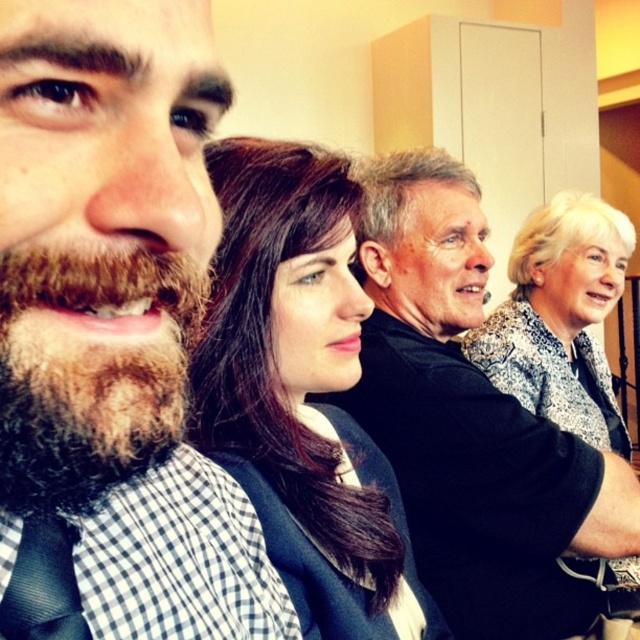
Question: Which object appears farthest from the camera in this image?

Choices:
 (A) brown fuzzy beard at left
 (B) checkered fabric shirt at left

Answer: (A)

Question: Can you confirm if black matte shirt at center is positioned above white printed blouse at upper right?

Choices:
 (A) yes
 (B) no

Answer: (B)

Question: Which of these objects is positioned closest to the white printed blouse at upper right?

Choices:
 (A) checkered fabric shirt at left
 (B) brown fuzzy beard at left
 (C) black matte shirt at center
 (D) dark brown hair at center

Answer: (C)

Question: Is checkered fabric shirt at left to the left of dark brown hair at center from the viewer's perspective?

Choices:
 (A) no
 (B) yes

Answer: (B)

Question: Which of the following is the farthest from the observer?

Choices:
 (A) checkered fabric shirt at left
 (B) black matte shirt at center
 (C) white printed blouse at upper right

Answer: (C)

Question: Can you confirm if dark brown hair at center is positioned above brown fuzzy beard at left?

Choices:
 (A) no
 (B) yes

Answer: (A)